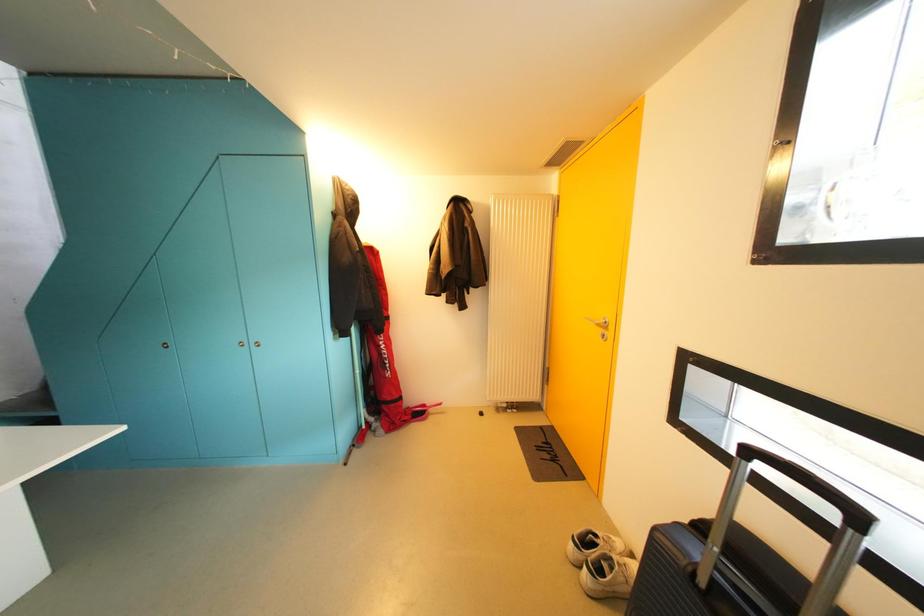
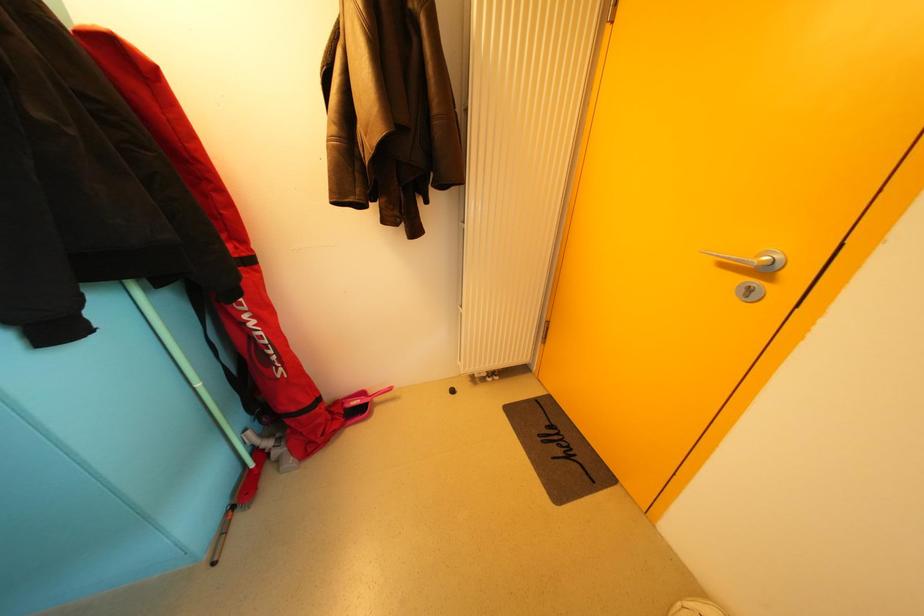
Question: The images are taken continuously from a first-person perspective. In which direction are you moving?

Choices:
 (A) Left
 (B) Right
 (C) Forward
 (D) Backward

Answer: (C)